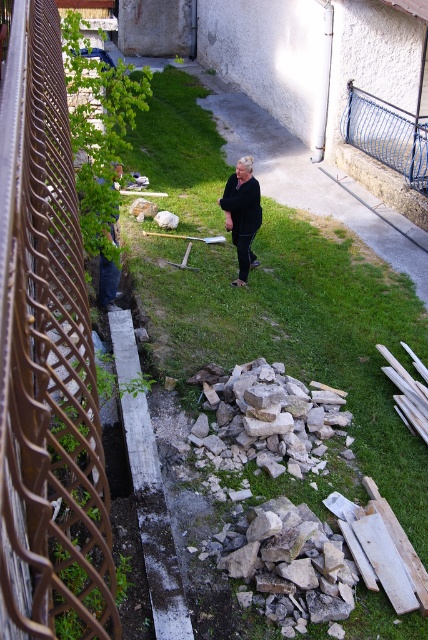
Question: From the image, what is the correct spatial relationship of green grass at center in relation to black matte jacket at center?

Choices:
 (A) above
 (B) below

Answer: (B)

Question: Which of the following is the farthest from the observer?

Choices:
 (A) dark blue jeans at lower left
 (B) gray rough stone at center
 (C) green grass at center

Answer: (A)

Question: Which of the following is the farthest from the observer?

Choices:
 (A) (312, 340)
 (B) (300, 465)
 (C) (235, 172)

Answer: (C)

Question: Is green grass at center below dark blue jeans at lower left?

Choices:
 (A) yes
 (B) no

Answer: (B)

Question: Considering the real-world distances, which object is closest to the green grass at center?

Choices:
 (A) gray rough stone at center
 (B) black matte jacket at center
 (C) dark blue jeans at lower left

Answer: (A)

Question: Is the position of black matte jacket at center more distant than that of dark blue jeans at lower left?

Choices:
 (A) yes
 (B) no

Answer: (A)